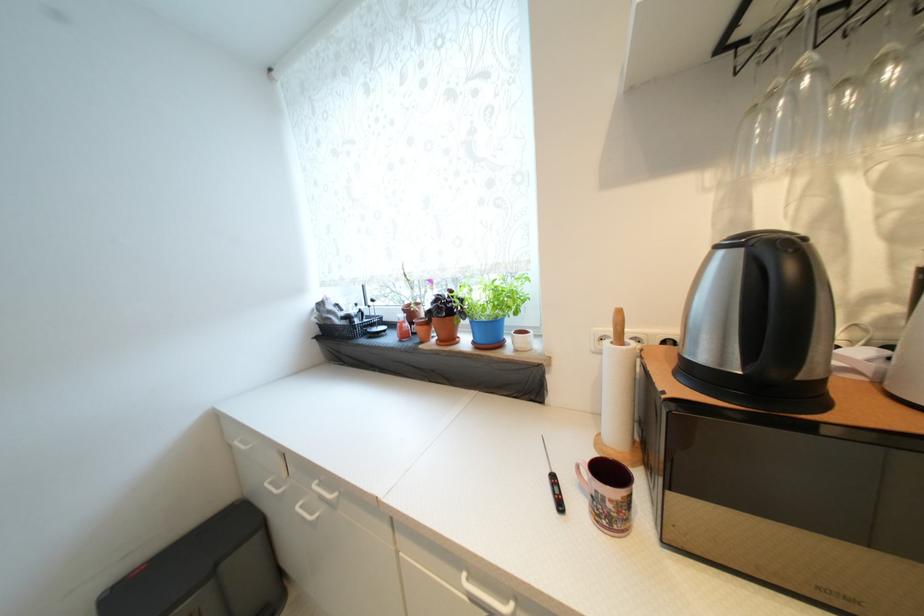
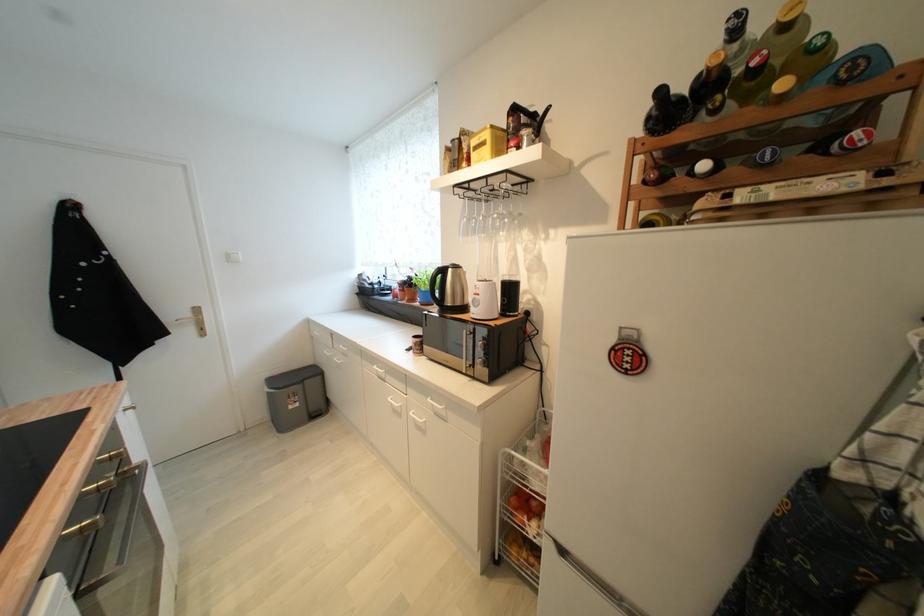
The images are taken continuously from a first-person perspective. In which direction are you moving?

The cameraman moved toward right, backward.